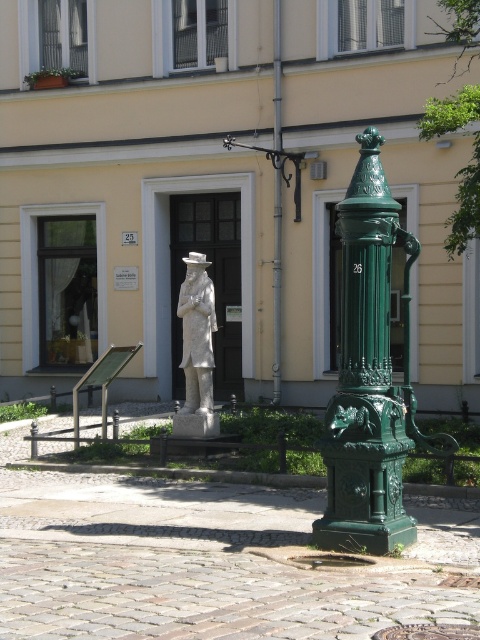
You are a city planner assessing the historical square. You need to determine if the white stone statue at center can be placed under the green cast iron lamp post at center for preservation purposes. Based on their sizes, is this feasible?

The white stone statue at center has a lesser height compared to the green cast iron lamp post at center, so it is feasible to place the white stone statue at center under the green cast iron lamp post at center as it is shorter and would fit under the lamp post.